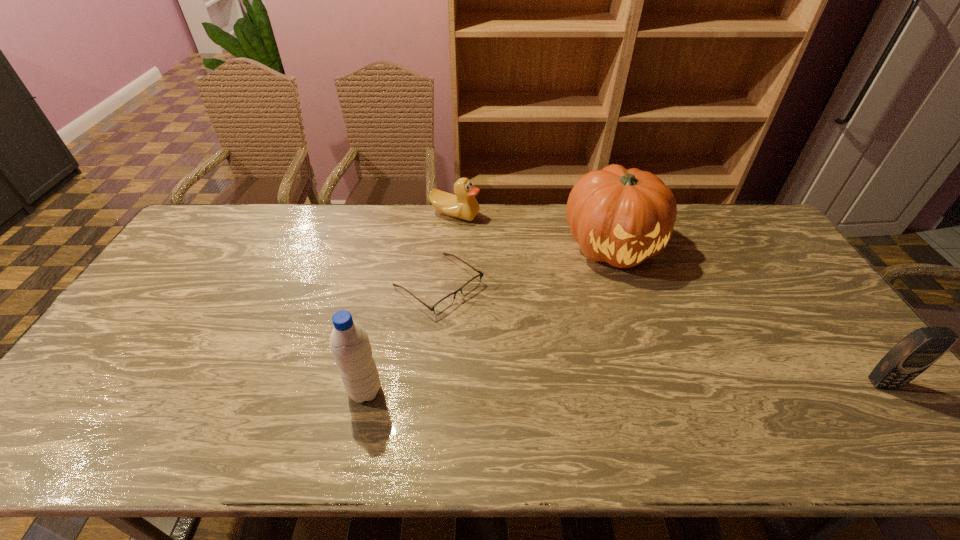
In order to click on vacant region located on the carved face of the fourth object from left to right in this screenshot , I will do `click(639, 293)`.

Locate an element on the screen. This screenshot has height=540, width=960. vacant space located 0.180m on the carved face of the fourth object from left to right is located at coordinates (659, 326).

Locate an element on the screen. This screenshot has height=540, width=960. vacant space situated 0.180m on the carved face of the fourth object from left to right is located at coordinates (659, 326).

The image size is (960, 540). In order to click on free point located 0.360m at the beak of the second shortest object in this screenshot , I will do [504, 293].

At what (x,y) coordinates should I click in order to perform the action: click on free space located 0.220m at the beak of the second shortest object. Please return your answer as a coordinate pair (x, y). Looking at the image, I should click on (487, 264).

Find the location of a particular element. free space located at the beak of the second shortest object is located at coordinates (502, 291).

Locate an element on the screen. The width and height of the screenshot is (960, 540). pumpkin at the far edge is located at coordinates (622, 217).

Image resolution: width=960 pixels, height=540 pixels. Identify the location of duck at the far edge. [463, 205].

Find the location of a particular element. Image resolution: width=960 pixels, height=540 pixels. water bottle that is at the near edge is located at coordinates (349, 342).

Locate an element on the screen. This screenshot has height=540, width=960. cellular telephone that is at the near edge is located at coordinates (915, 353).